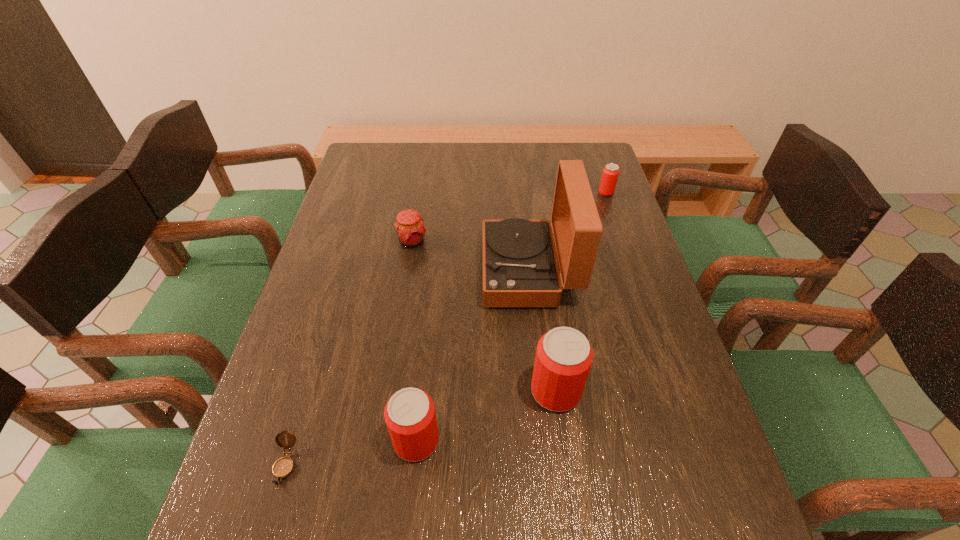
Find the location of a particular element. vacant space that satisfies the following two spatial constraints: 1. on the face of the tallest object; 2. on the face of the shortest object is located at coordinates (549, 464).

I want to click on free space that satisfies the following two spatial constraints: 1. on the face of the second tallest object; 2. on the left side of the phonograph record, so coord(541,391).

This screenshot has height=540, width=960. I want to click on free space in the image that satisfies the following two spatial constraints: 1. on the front side of the second tallest beer can; 2. on the right side of the jam, so click(x=380, y=441).